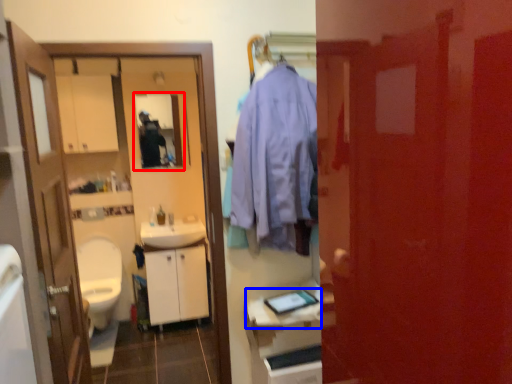
Question: Among these objects, which one is nearest to the camera, mirror (highlighted by a red box) or counter top (highlighted by a blue box)?

Choices:
 (A) mirror
 (B) counter top

Answer: (B)